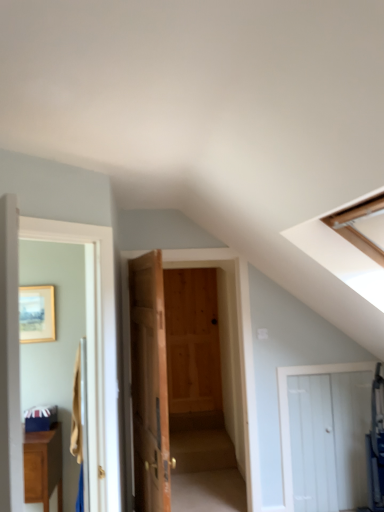
Question: Is matte brown cabinet at lower left in front of white wooden door at lower right, acting as the 1th door starting from the right?

Choices:
 (A) yes
 (B) no

Answer: (A)

Question: Does matte brown cabinet at lower left appear on the right side of white wooden door at lower right, the 4th door in the left-to-right sequence?

Choices:
 (A) yes
 (B) no

Answer: (B)

Question: Considering the relative sizes of matte brown cabinet at lower left and white wooden door at lower right, the 4th door in the left-to-right sequence, in the image provided, is matte brown cabinet at lower left smaller than white wooden door at lower right, the 4th door in the left-to-right sequence,?

Choices:
 (A) yes
 (B) no

Answer: (B)

Question: From the image's perspective, is matte brown cabinet at lower left over white wooden door at lower right, acting as the 1th door starting from the right?

Choices:
 (A) yes
 (B) no

Answer: (B)

Question: Is matte brown cabinet at lower left aimed at white wooden door at lower right, acting as the 1th door starting from the right?

Choices:
 (A) no
 (B) yes

Answer: (A)

Question: From the image's perspective, relative to wooden picture frame at upper left, is matte brown cabinet at lower left above or below?

Choices:
 (A) above
 (B) below

Answer: (B)

Question: Which is correct: matte brown cabinet at lower left is inside wooden picture frame at upper left, or outside of it?

Choices:
 (A) outside
 (B) inside

Answer: (A)

Question: From a real-world perspective, is matte brown cabinet at lower left above or below wooden picture frame at upper left?

Choices:
 (A) above
 (B) below

Answer: (B)

Question: Is matte brown cabinet at lower left wider or thinner than wooden picture frame at upper left?

Choices:
 (A) wide
 (B) thin

Answer: (A)

Question: From the image's perspective, relative to wooden door at center, which is the 3th door from right to left, is white wooden door at left, which appears as the 1th door when viewed from the left, above or below?

Choices:
 (A) below
 (B) above

Answer: (B)

Question: From a real-world perspective, is white wooden door at left, which appears as the 1th door when viewed from the left, above or below wooden door at center, which is the 3th door from right to left?

Choices:
 (A) below
 (B) above

Answer: (B)

Question: Which is correct: white wooden door at left, the 4th door positioned from the right, is inside wooden door at center, which is the 3th door from right to left, or outside of it?

Choices:
 (A) outside
 (B) inside

Answer: (A)

Question: Is point (107, 418) positioned closer to the camera than point (130, 332)?

Choices:
 (A) farther
 (B) closer

Answer: (B)

Question: Is white wooden door at left, the 4th door positioned from the right, wider or thinner than natural wood door at center, arranged as the 3th door when viewed from the left?

Choices:
 (A) wide
 (B) thin

Answer: (B)

Question: In terms of height, does white wooden door at left, the 4th door positioned from the right, look taller or shorter compared to natural wood door at center, arranged as the 3th door when viewed from the left?

Choices:
 (A) short
 (B) tall

Answer: (A)